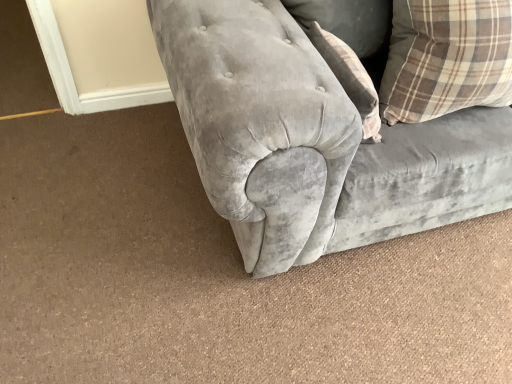
Question: From the image's perspective, is brown plaid pillow at upper right located above or below velvet gray couch at center?

Choices:
 (A) above
 (B) below

Answer: (B)

Question: In the image, is brown plaid pillow at upper right positioned in front of or behind velvet gray couch at center?

Choices:
 (A) behind
 (B) front

Answer: (A)

Question: Based on their positions, is brown plaid pillow at upper right located to the left or right of velvet gray couch at center?

Choices:
 (A) right
 (B) left

Answer: (B)

Question: Considering the relative positions of velvet gray couch at center and brown plaid pillow at upper right in the image provided, is velvet gray couch at center to the left or to the right of brown plaid pillow at upper right?

Choices:
 (A) right
 (B) left

Answer: (A)

Question: From a real-world perspective, relative to brown plaid pillow at upper right, is velvet gray couch at center vertically above or below?

Choices:
 (A) above
 (B) below

Answer: (B)

Question: From the image's perspective, relative to brown plaid pillow at upper right, is velvet gray couch at center above or below?

Choices:
 (A) above
 (B) below

Answer: (A)

Question: Looking at the image, does velvet gray couch at center seem bigger or smaller compared to brown plaid pillow at upper right?

Choices:
 (A) small
 (B) big

Answer: (B)